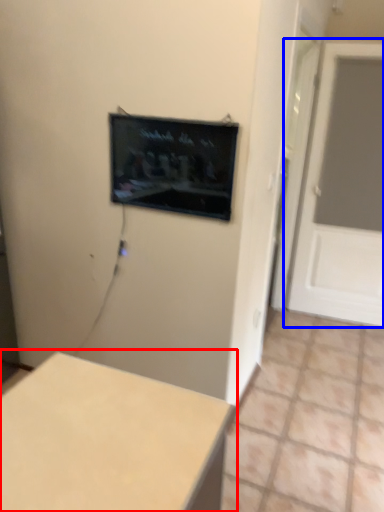
Question: Which object is closer to the camera taking this photo, table (highlighted by a red box) or door (highlighted by a blue box)?

Choices:
 (A) table
 (B) door

Answer: (A)